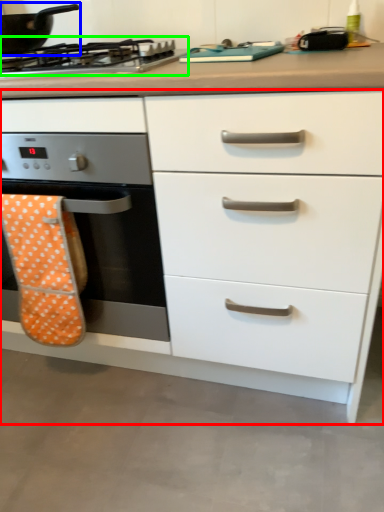
Question: Estimate the real-world distances between objects in this image. Which object is closer to chest of drawers (highlighted by a red box), kitchen appliance (highlighted by a blue box) or gas stove (highlighted by a green box)?

Choices:
 (A) kitchen appliance
 (B) gas stove

Answer: (B)